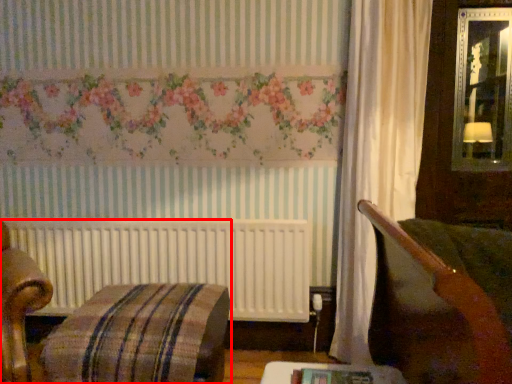
Question: Where is furniture (annotated by the red box) located in relation to table in the image?

Choices:
 (A) left
 (B) right

Answer: (A)